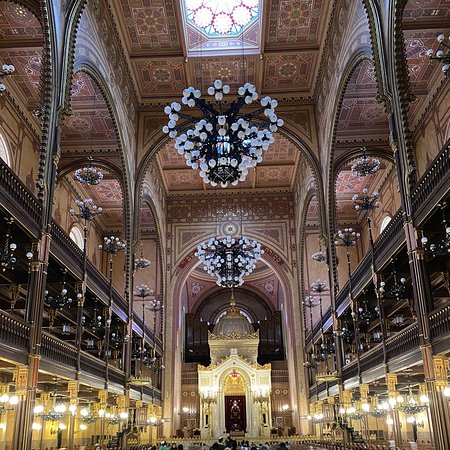
Identify the location of large center chandelier. (228, 270), (226, 137).